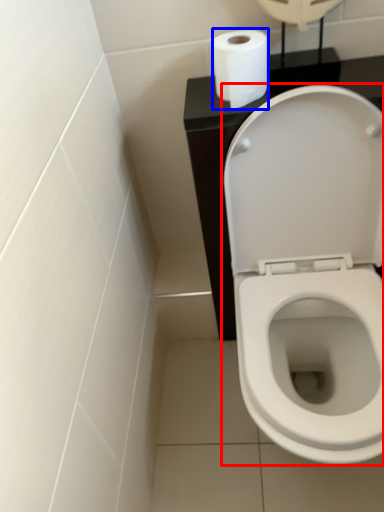
Question: Among these objects, which one is nearest to the camera, toilet (highlighted by a red box) or toilet paper (highlighted by a blue box)?

Choices:
 (A) toilet
 (B) toilet paper

Answer: (A)